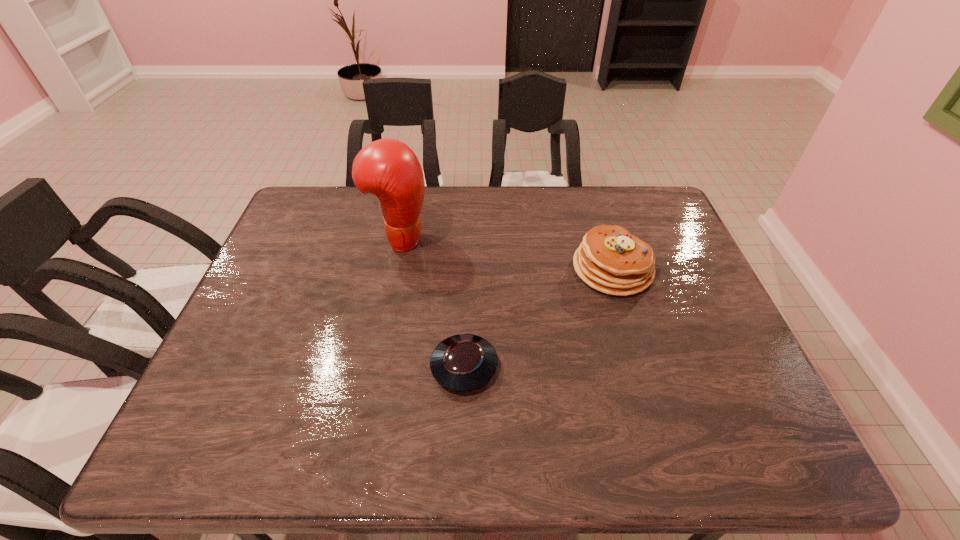
You are a GUI agent. You are given a task and a screenshot of the screen. Output one action in this format:
    pyautogui.click(x=<x>, y=<y>)
    Task: Click on the vacant space that is in between the boxing glove and the shortest object
    Image resolution: width=960 pixels, height=540 pixels.
    Given the screenshot: What is the action you would take?
    pyautogui.click(x=432, y=303)

You are a GUI agent. You are given a task and a screenshot of the screen. Output one action in this format:
    pyautogui.click(x=<x>, y=<y>)
    Task: Click on the unoccupied position between the shortest object and the boxing glove
    The height and width of the screenshot is (540, 960).
    Given the screenshot: What is the action you would take?
    pyautogui.click(x=432, y=303)

You are a GUI agent. You are given a task and a screenshot of the screen. Output one action in this format:
    pyautogui.click(x=<x>, y=<y>)
    Task: Click on the free space between the boxing glove and the second object from right to left
    
    Given the screenshot: What is the action you would take?
    click(x=432, y=303)

The width and height of the screenshot is (960, 540). In order to click on free space between the nearest object and the pancake in this screenshot , I will do `click(539, 318)`.

This screenshot has width=960, height=540. I want to click on unoccupied area between the second tallest object and the leftmost object, so 506,254.

The image size is (960, 540). I want to click on vacant point located between the pancake and the shortest object, so click(x=539, y=318).

Identify which object is the second closest to the pancake. Please provide its 2D coordinates. Your answer should be formatted as a tuple, i.e. [(x, y)], where the tuple contains the x and y coordinates of a point satisfying the conditions above.

[(388, 168)]

Find the location of a particular element. object that is the second closest one to the leftmost object is located at coordinates (611, 260).

The height and width of the screenshot is (540, 960). I want to click on vacant space that satisfies the following two spatial constraints: 1. on the striking surface of the boxing glove; 2. on the back side of the second tallest object, so click(x=394, y=269).

You are a GUI agent. You are given a task and a screenshot of the screen. Output one action in this format:
    pyautogui.click(x=<x>, y=<y>)
    Task: Click on the free location that satisfies the following two spatial constraints: 1. on the striking surface of the tallest object; 2. on the back side of the second object from right to left
    This screenshot has width=960, height=540.
    Given the screenshot: What is the action you would take?
    pyautogui.click(x=374, y=367)